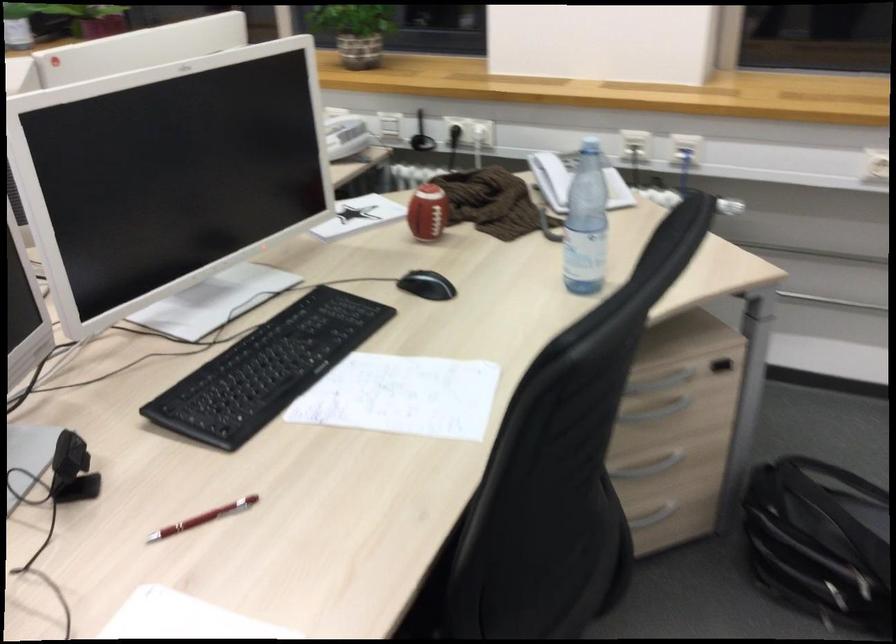
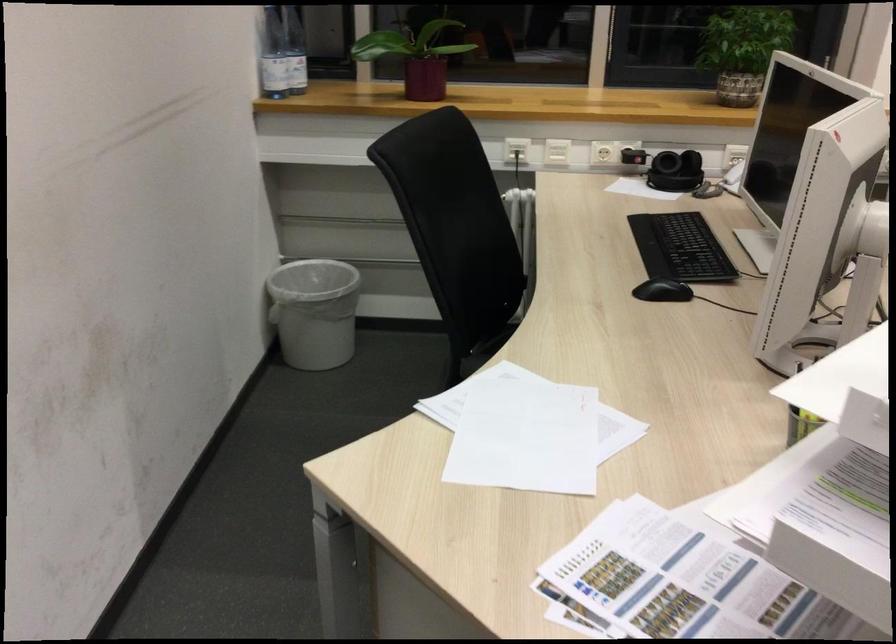
Question: What movement of the cameraman would produce the second image?

Choices:
 (A) Left
 (B) Right
 (C) Forward
 (D) Backward

Answer: (A)